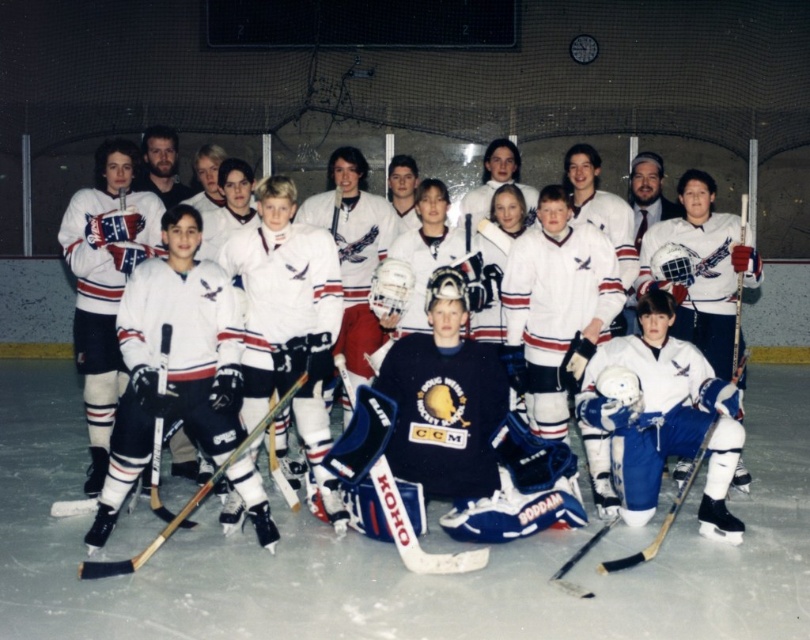
You are a hockey coach trying to organize equipment. You see the blue plastic hockey stick at center and the wooden hockey stick at center. If you need to place them side by side on a shelf that is 3 feet long, will they fit?

The distance between the blue plastic hockey stick at center and wooden hockey stick at center is 38.92 inches. Since 3 feet equals 36 inches, the total length required would exceed the shelf length. Therefore, they won

You are a photographer setting up for a team photo. You have a white matte hockey jerseys at center and a blue plastic hockey stick at center in the scene. Which object should you focus on first if you want to capture the larger item in your frame?

The white matte hockey jerseys at center has a larger size compared to the blue plastic hockey stick at center, so you should focus on the white matte hockey jerseys at center first to capture the larger item in your frame.

You are a photographer taking a team photo on an ice rink. You notice the white matte hockey jerseys at center and the wooden hockey stick at center. Which object is positioned higher from the ground?

The white matte hockey jerseys at center are positioned higher from the ground than the wooden hockey stick at center because the jerseys are at center and the stick is also at center but the description states the jerseys are above the stick.